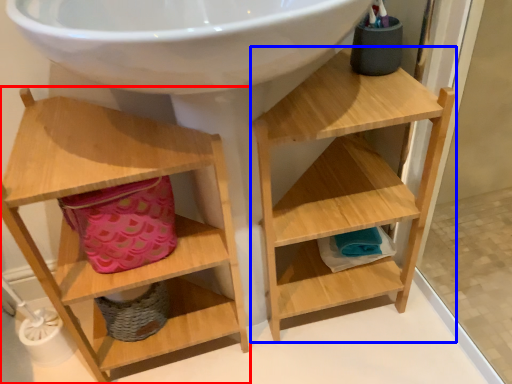
Question: Which point is closer to the camera, shelf (highlighted by a red box) or shelf (highlighted by a blue box)?

Choices:
 (A) shelf
 (B) shelf

Answer: (A)